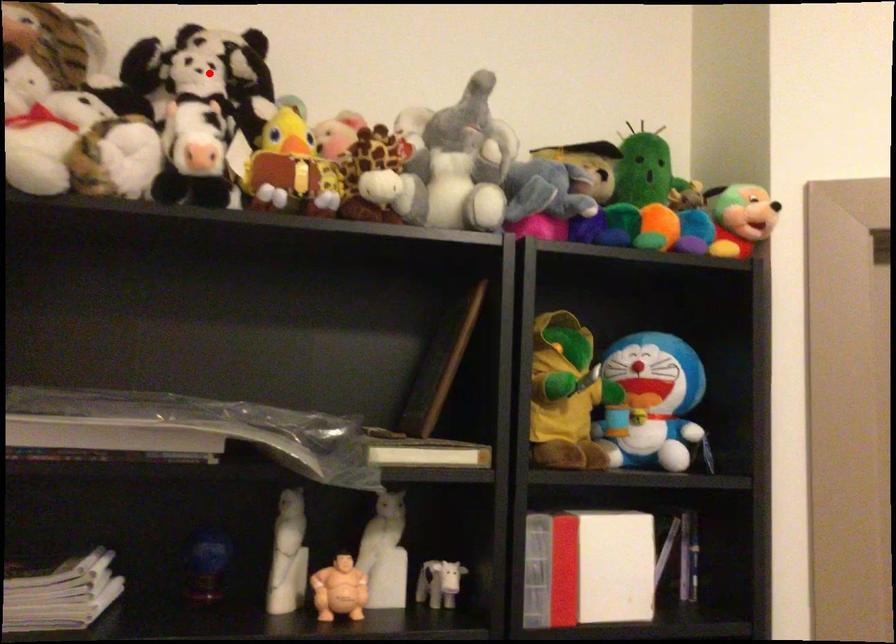
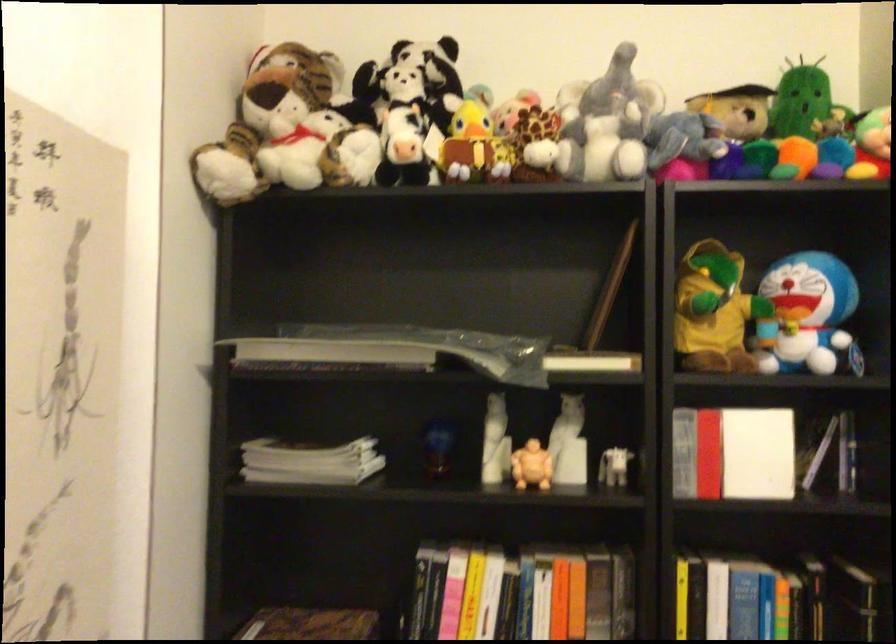
Question: I am providing you with two images of the same scene from different viewpoints. In image1, a red point is highlighted. Considering the same 3D point in image2, which of the following is correct?

Choices:
 (A) It is closer
 (B) It is farther

Answer: (B)